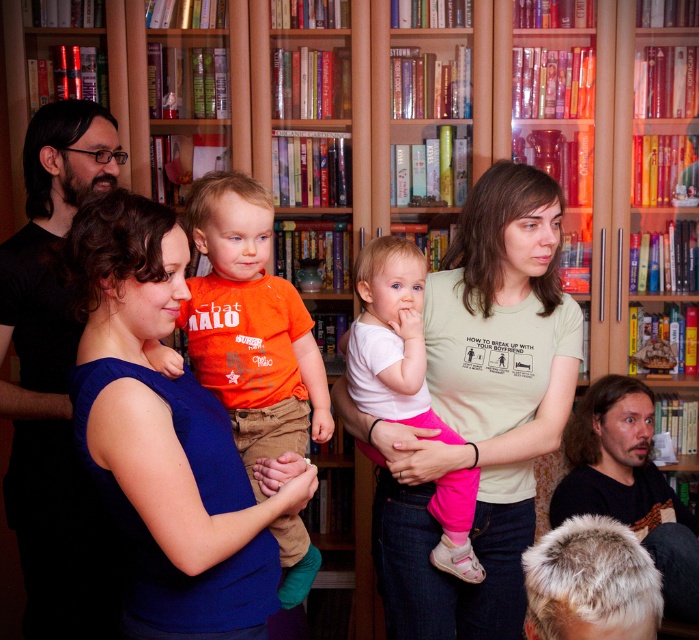
You are a photographer trying to capture a candid shot of the dark brown hair at lower right and the white cotton shirt at center. Since you want to ensure both subjects are in focus, you need to know their heights. Which subject is shorter?

The dark brown hair at lower right is shorter than the white cotton shirt at center.

You are a parent standing at the point marked by the coordinate point at (243, 269) in the image. You want to hand your child to another parent who is standing 1.63 meters away. Can you safely hand over the child without moving closer?

The distance between the point marked by the coordinate point at (243, 269) and the other parent is 1.63 meters. Since the parent cannot move closer, handing over the child from this distance may be challenging and not safe. It is recommended to move closer for a safer transfer.

You are a photographer standing in the library scene. You want to take a closeup photo of the orange cotton shirt at center. What is the minimum distance you need to move forward to ensure the shirt is in focus?

The orange cotton shirt at center is 1.55 meters away from the viewer. To take a closeup photo, you need to move forward until you are within the minimum focusing distance of your camera lens. However, since the shirt is already at 1.55 meters, if your lens can focus at that distance or closer, you can take the photo without moving. If your lens requires a closer distance, you would need to move forward accordingly.